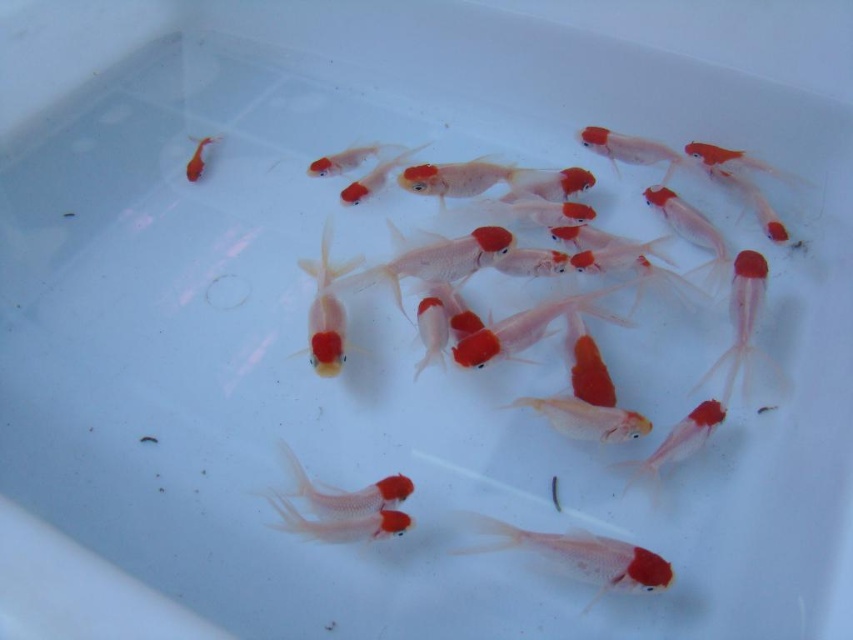
You are a fish breeder who wants to select the bigger goldfish between the matte white goldfish at center and the matte orange goldfish at upper left for a competition. Which one should you choose?

The matte white goldfish at center has a larger size compared to the matte orange goldfish at upper left, so you should choose the matte white goldfish at center for the competition.

You are looking at the goldfish container and notice two points marked in the image. The first point is at coordinates point (x=502, y=544) and the second is at point (x=193, y=157). Which of these points is closer to you?

Point (x=502, y=544) is closer to the viewer than point (x=193, y=157).

You are observing the goldfish in the container. Which goldfish is positioned closer to you, the translucent white goldfish at center or the matte white goldfish at center?

The translucent white goldfish at center is closer to the viewer than the matte white goldfish at center.